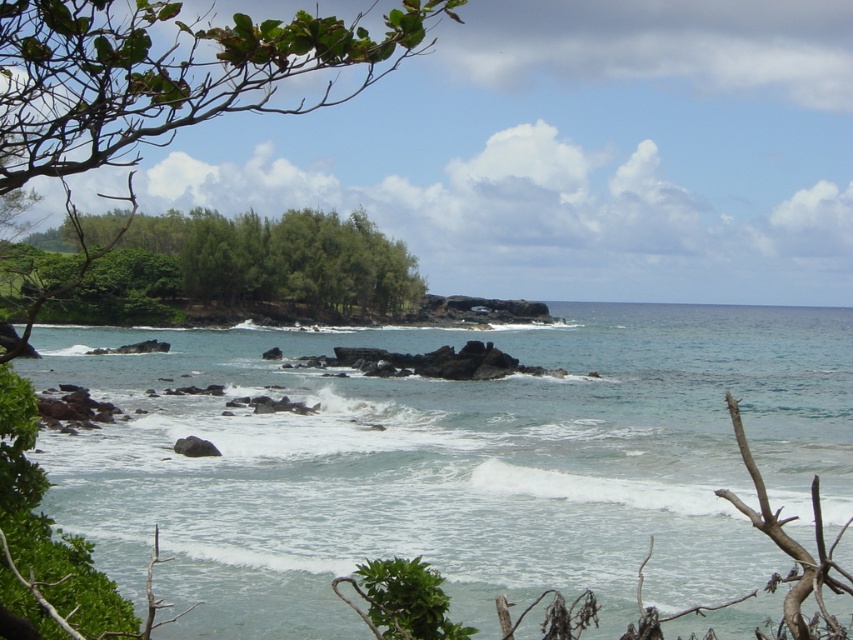
Does clear blue water at center come in front of green leafy trees at center?

Yes, it is.

Is clear blue water at center to the left of green leafy trees at center from the viewer's perspective?

No, clear blue water at center is not to the left of green leafy trees at center.

Measure the distance between point [463,490] and camera.

Point [463,490] and camera are 21.37 meters apart from each other.

This screenshot has width=853, height=640. What are the coordinates of `clear blue water at center` in the screenshot? It's located at coord(456,461).

Is green leafy tree at upper left above green leafy trees at center?

Yes, green leafy tree at upper left is above green leafy trees at center.

Is green leafy tree at upper left positioned at the back of green leafy trees at center?

No, it is not.

Describe the element at coordinates (161, 76) in the screenshot. I see `green leafy tree at upper left` at that location.

I want to click on green leafy tree at upper left, so click(x=161, y=76).

Is point (730, 529) farther from camera compared to point (90, 72)?

Yes, point (730, 529) is farther from viewer.

From the picture: Does clear blue water at center have a larger size compared to green leafy tree at upper left?

Actually, clear blue water at center might be smaller than green leafy tree at upper left.

This screenshot has width=853, height=640. I want to click on clear blue water at center, so pyautogui.click(x=456, y=461).